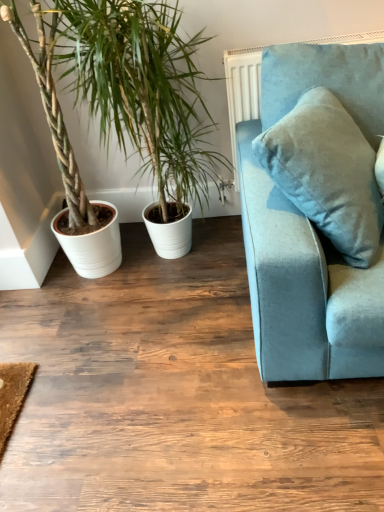
Question: Is velvet blue couch at right facing away from white ceramic plant at left?

Choices:
 (A) yes
 (B) no

Answer: (A)

Question: Is velvet blue couch at right in contact with white ceramic plant at left?

Choices:
 (A) no
 (B) yes

Answer: (A)

Question: Considering the relative sizes of velvet blue couch at right and white ceramic plant at left in the image provided, is velvet blue couch at right taller than white ceramic plant at left?

Choices:
 (A) yes
 (B) no

Answer: (B)

Question: Is velvet blue couch at right aimed at white ceramic plant at left?

Choices:
 (A) yes
 (B) no

Answer: (B)

Question: Considering the relative sizes of velvet blue couch at right and white ceramic plant at left in the image provided, is velvet blue couch at right bigger than white ceramic plant at left?

Choices:
 (A) yes
 (B) no

Answer: (B)

Question: Does velvet blue couch at right lie behind white ceramic plant at left?

Choices:
 (A) yes
 (B) no

Answer: (B)

Question: Does white ceramic plant at left contain velvet blue couch at right?

Choices:
 (A) yes
 (B) no

Answer: (B)

Question: Is white ceramic plant at left shorter than velvet blue couch at right?

Choices:
 (A) no
 (B) yes

Answer: (A)

Question: Can you confirm if white ceramic plant at left is positioned to the left of velvet blue couch at right?

Choices:
 (A) no
 (B) yes

Answer: (B)

Question: From the image's perspective, does white ceramic plant at left appear higher than velvet blue couch at right?

Choices:
 (A) no
 (B) yes

Answer: (B)

Question: Considering the relative sizes of white ceramic plant at left and velvet blue couch at right in the image provided, is white ceramic plant at left smaller than velvet blue couch at right?

Choices:
 (A) yes
 (B) no

Answer: (B)

Question: Does white ceramic plant at left have a greater height compared to velvet blue couch at right?

Choices:
 (A) yes
 (B) no

Answer: (A)

Question: From the image's perspective, is white ceramic plant at left located above or below velvet blue couch at right?

Choices:
 (A) above
 (B) below

Answer: (A)